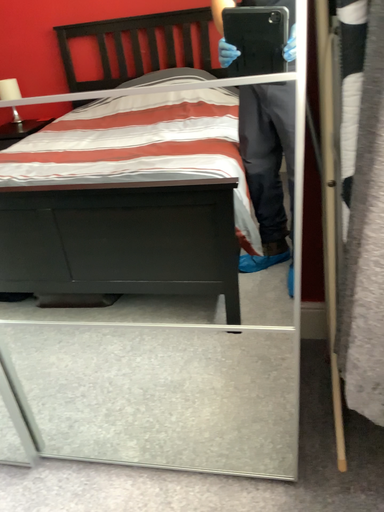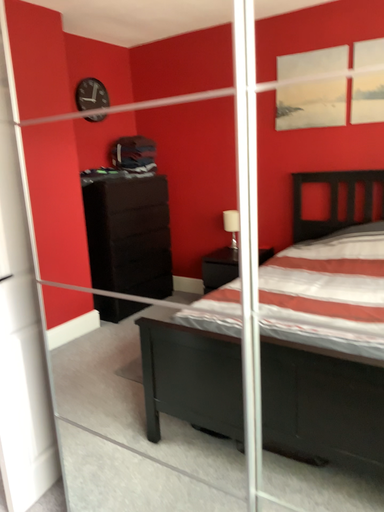
Question: How did the camera likely rotate when shooting the video?

Choices:
 (A) rotated upward
 (B) rotated downward

Answer: (A)